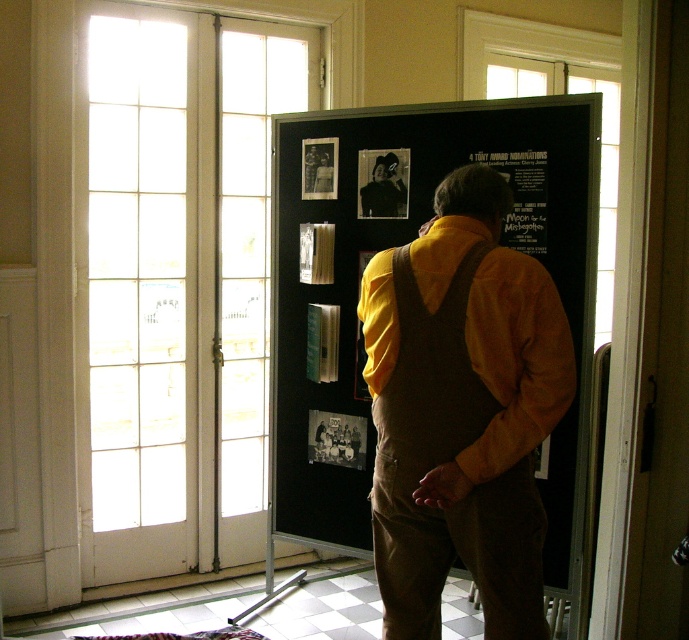
Is matte black poster at center wider than black paper at center?

Yes, matte black poster at center is wider than black paper at center.

Can you confirm if matte black poster at center is taller than black paper at center?

Indeed, matte black poster at center has a greater height compared to black paper at center.

Does point (524, 186) come farther from viewer compared to point (362, 432)?

That is False.

You are a GUI agent. You are given a task and a screenshot of the screen. Output one action in this format:
    pyautogui.click(x=<x>, y=<y>)
    Task: Click on the matte black poster at center
    
    Given the screenshot: What is the action you would take?
    pyautogui.click(x=522, y=196)

Find the location of a particular element. The width and height of the screenshot is (689, 640). brown suede overalls at center is located at coordinates (462, 412).

Does brown suede overalls at center have a lesser height compared to black paper at center?

In fact, brown suede overalls at center may be taller than black paper at center.

You are a GUI agent. You are given a task and a screenshot of the screen. Output one action in this format:
    pyautogui.click(x=<x>, y=<y>)
    Task: Click on the brown suede overalls at center
    
    Given the screenshot: What is the action you would take?
    pyautogui.click(x=462, y=412)

Between white glass door at left and matte black poster at center, which one appears on the right side from the viewer's perspective?

matte black poster at center

Looking at this image, which of these two, white glass door at left or matte black poster at center, stands shorter?

matte black poster at center is shorter.

Find the location of a particular element. The width and height of the screenshot is (689, 640). white glass door at left is located at coordinates (178, 284).